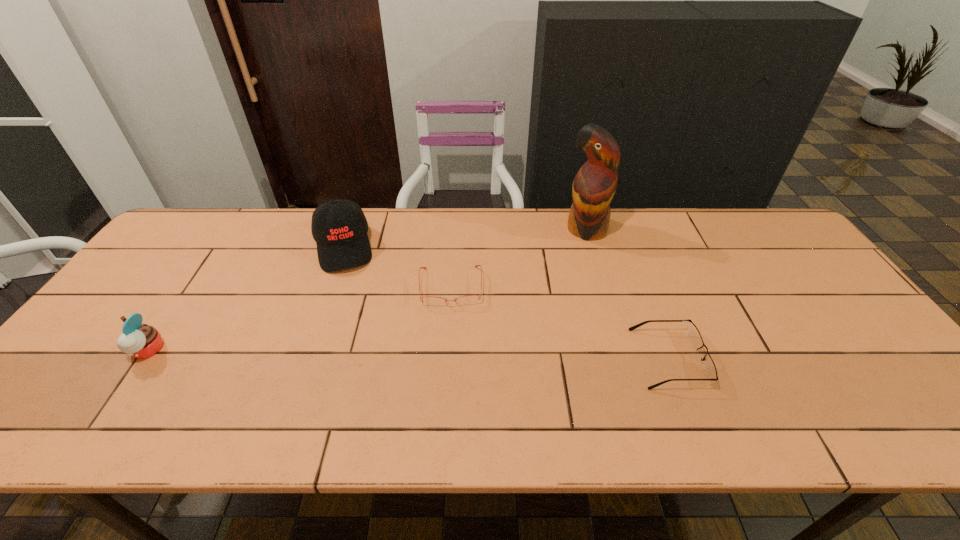
Locate an element on the screen. The image size is (960, 540). vacant region between the muffin and the nearer spectacles is located at coordinates (408, 355).

This screenshot has height=540, width=960. I want to click on free area in between the baseball cap and the farther spectacles, so click(x=397, y=267).

The height and width of the screenshot is (540, 960). In order to click on vacant area that lies between the third object from left to right and the nearer spectacles in this screenshot , I will do `click(560, 322)`.

The width and height of the screenshot is (960, 540). I want to click on vacant area that lies between the right spectacles and the baseball cap, so click(x=507, y=303).

Locate an element on the screen. Image resolution: width=960 pixels, height=540 pixels. vacant area between the baseball cap and the third object from right to left is located at coordinates (397, 267).

You are a GUI agent. You are given a task and a screenshot of the screen. Output one action in this format:
    pyautogui.click(x=<x>, y=<y>)
    Task: Click on the unoccupied position between the leftmost object and the farther spectacles
    The height and width of the screenshot is (540, 960).
    Given the screenshot: What is the action you would take?
    (299, 319)

You are a GUI agent. You are given a task and a screenshot of the screen. Output one action in this format:
    pyautogui.click(x=<x>, y=<y>)
    Task: Click on the free area in between the tallest object and the fourth object from right to left
    
    Given the screenshot: What is the action you would take?
    pyautogui.click(x=465, y=238)

At what (x,y) coordinates should I click in order to perform the action: click on free space that is in between the fourth object from right to left and the parrot. Please return your answer as a coordinate pair (x, y). The image size is (960, 540). Looking at the image, I should click on (465, 238).

Image resolution: width=960 pixels, height=540 pixels. Identify the location of vacant space in between the nearer spectacles and the farther spectacles. (560, 322).

The width and height of the screenshot is (960, 540). I want to click on vacant area that lies between the muffin and the fourth object from right to left, so click(x=245, y=299).